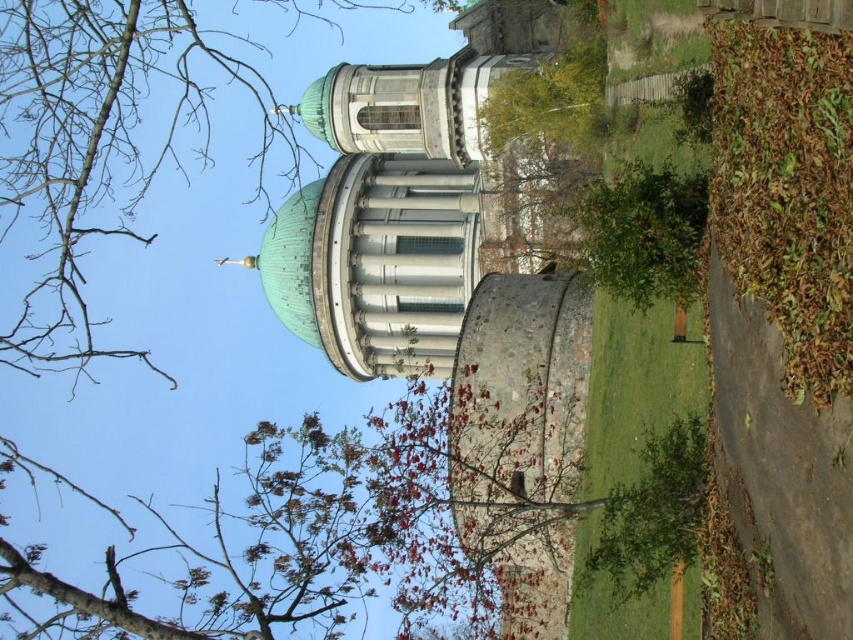
Between green dome at center and brown leafy tree at upper center, which one is positioned lower?

green dome at center is lower down.

Between green dome at center and brown leafy tree at upper center, which one appears on the left side from the viewer's perspective?

brown leafy tree at upper center is more to the left.

Where is `green dome at center`? This screenshot has height=640, width=853. green dome at center is located at coordinates (x=399, y=198).

Image resolution: width=853 pixels, height=640 pixels. What are the coordinates of `green dome at center` in the screenshot? It's located at (399, 198).